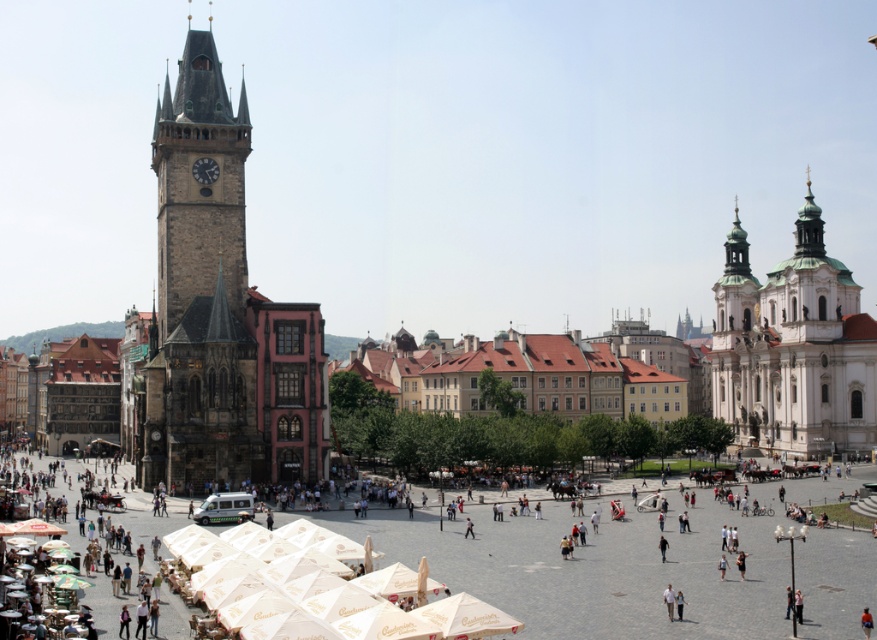
Is stone clock tower at left below white stone church at right?

Actually, stone clock tower at left is above white stone church at right.

Does stone clock tower at left have a lesser height compared to white stone church at right?

No, stone clock tower at left is not shorter than white stone church at right.

Identify the location of stone clock tower at left. The height and width of the screenshot is (640, 877). (198, 289).